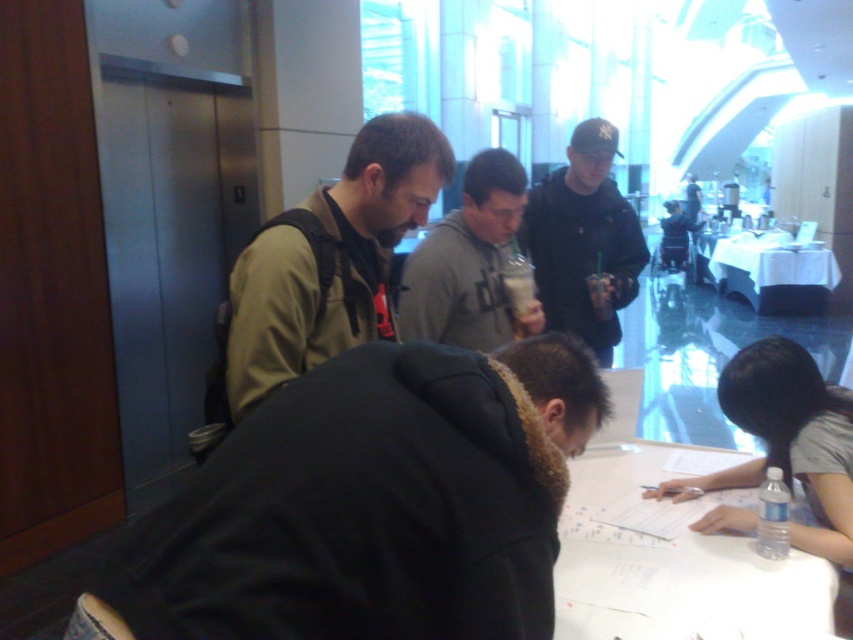
Question: Which point is closer to the camera?

Choices:
 (A) white paper at lower right
 (B) white cloth table at center
 (C) black matte jacket at upper center

Answer: (A)

Question: Does white paper at lower right appear on the left side of gray matte hoodie at center?

Choices:
 (A) no
 (B) yes

Answer: (A)

Question: Which object is closer to the camera taking this photo?

Choices:
 (A) black matte jacket at upper center
 (B) white paper at lower right

Answer: (B)

Question: Is black matte jacket at upper center smaller than gray matte hoodie at center?

Choices:
 (A) yes
 (B) no

Answer: (B)

Question: Estimate the real-world distances between objects in this image. Which object is closer to the white paper at lower right?

Choices:
 (A) greenish-brown leather jacket at center-left
 (B) white cloth table at center
 (C) black matte jacket at upper center
 (D) gray matte hoodie at center

Answer: (D)

Question: Is greenish-brown leather jacket at center-left bigger than black matte jacket at upper center?

Choices:
 (A) no
 (B) yes

Answer: (A)